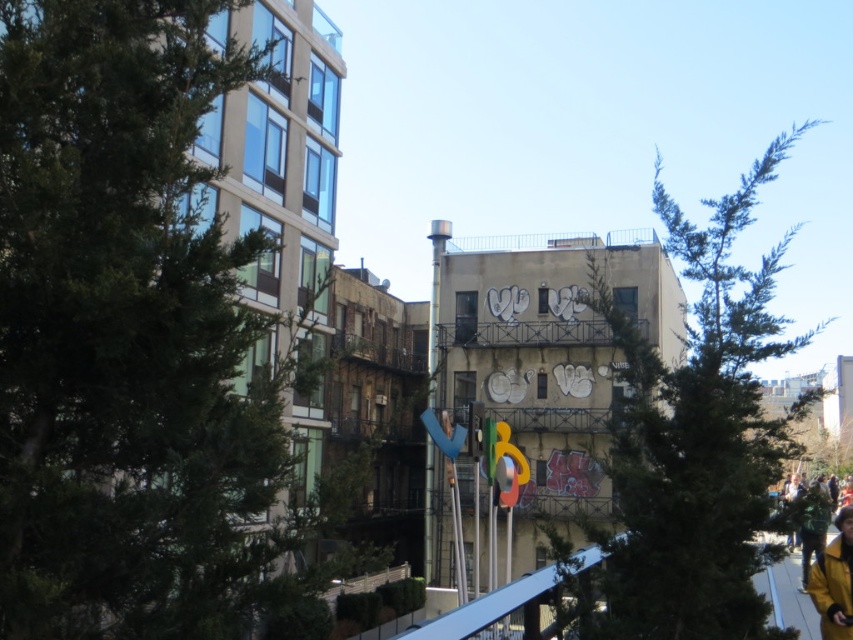
Question: Considering the real-world distances, which object is closest to the green matte tree at left?

Choices:
 (A) yellow matte jacket at lower right
 (B) green needle-like tree at center

Answer: (A)

Question: Does green needle-like tree at center lie behind yellow matte jacket at lower right?

Choices:
 (A) yes
 (B) no

Answer: (B)

Question: Does green matte tree at left lie in front of green needle-like tree at center?

Choices:
 (A) no
 (B) yes

Answer: (B)

Question: Is green matte tree at left smaller than yellow matte jacket at lower right?

Choices:
 (A) no
 (B) yes

Answer: (A)

Question: Which is nearer to the yellow matte jacket at lower right?

Choices:
 (A) green matte tree at left
 (B) green needle-like tree at center

Answer: (A)

Question: Which object is positioned farthest from the yellow matte jacket at lower right?

Choices:
 (A) green matte tree at left
 (B) green needle-like tree at center

Answer: (B)